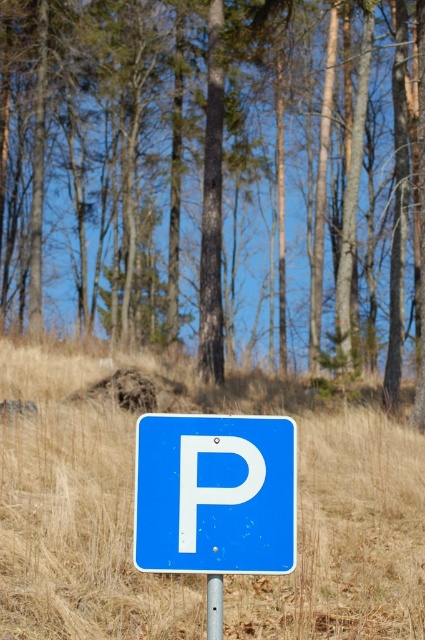
Between white matte letter p at center and metallic pole at center, which one is positioned lower?

Positioned lower is metallic pole at center.

Is white matte letter p at center wider than metallic pole at center?

Correct, the width of white matte letter p at center exceeds that of metallic pole at center.

This screenshot has width=425, height=640. Describe the element at coordinates (210, 484) in the screenshot. I see `white matte letter p at center` at that location.

Identify the location of white matte letter p at center. point(210,484).

Can you confirm if brown bark tree at center is thinner than white matte letter p at center?

No.

Is brown bark tree at center further to camera compared to white matte letter p at center?

Yes, it is.

Locate an element on the screen. Image resolution: width=425 pixels, height=640 pixels. brown bark tree at center is located at coordinates (218, 177).

The image size is (425, 640). I want to click on brown bark tree at center, so click(x=218, y=177).

Consider the image. Can you confirm if dry grass at center is positioned to the right of metallic pole at center?

Incorrect, dry grass at center is not on the right side of metallic pole at center.

Which is more to the left, dry grass at center or metallic pole at center?

dry grass at center is more to the left.

Is point (59, 564) closer to camera compared to point (215, 624)?

No, it is behind (215, 624).

Find the location of a particular element. This screenshot has height=640, width=425. dry grass at center is located at coordinates (76, 515).